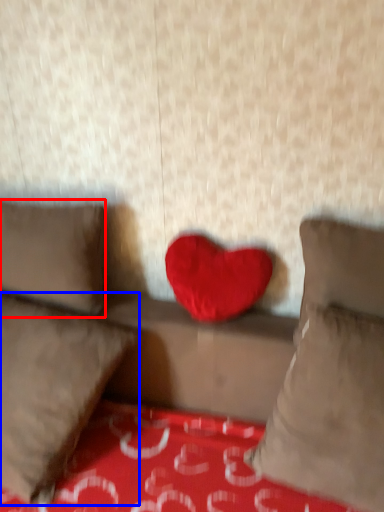
Question: Which object is closer to the camera taking this photo, pillow (highlighted by a red box) or pillow (highlighted by a blue box)?

Choices:
 (A) pillow
 (B) pillow

Answer: (B)